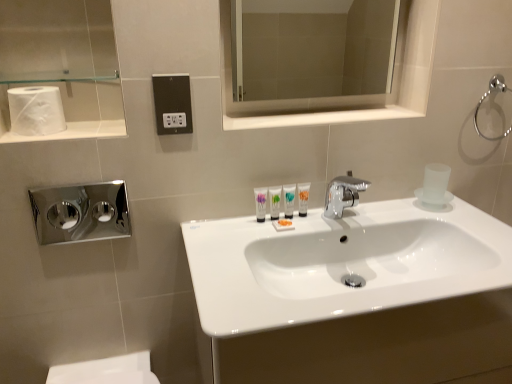
Question: Is white glossy sink at center in front of or behind chrome metallic towel ring at upper right in the image?

Choices:
 (A) behind
 (B) front

Answer: (B)

Question: Does point (248, 306) appear closer or farther from the camera than point (493, 77)?

Choices:
 (A) closer
 (B) farther

Answer: (A)

Question: Estimate the real-world distances between objects in this image. Which object is farther from the black plastic outlet at center?

Choices:
 (A) matte white tube at center, the second mouthwash in the right-to-left sequence
 (B) chrome metallic towel ring at upper right
 (C) polished chrome faucet at center
 (D) chrome/metallic hand dryer at left
 (E) white glossy medicine cabinet at upper center

Answer: (D)

Question: Which object is positioned closest to the black plastic outlet at center?

Choices:
 (A) white glossy sink at center
 (B) white matte toilet paper at upper left
 (C) white glossy tube at center, arranged as the second toiletry when viewed from the right
 (D) matte white tube at center, which appears as the first mouthwash when viewed from the left
 (E) chrome/metallic hand dryer at left

Answer: (B)